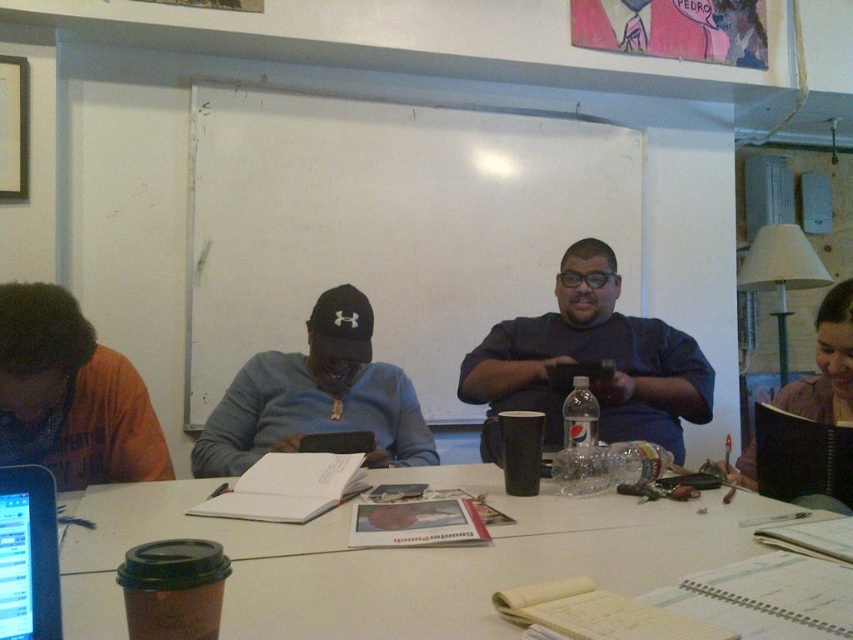
You are a GUI agent. You are given a task and a screenshot of the screen. Output one action in this format:
    pyautogui.click(x=<x>, y=<y>)
    Task: Click on the white matte whiteboard at center
    Image resolution: width=853 pixels, height=640 pixels.
    Given the screenshot: What is the action you would take?
    pyautogui.click(x=387, y=225)

Is point (451, 266) behind point (821, 355)?

Yes, it is.

Identify the location of white matte whiteboard at center. (387, 225).

What do you see at coordinates (399, 557) in the screenshot?
I see `white matte table at center` at bounding box center [399, 557].

Identify the location of white matte table at center. This screenshot has width=853, height=640. (399, 557).

Between orange cotton shirt at left and black matte cap at center, which one appears on the right side from the viewer's perspective?

black matte cap at center

Between orange cotton shirt at left and black matte cap at center, which one appears on the left side from the viewer's perspective?

From the viewer's perspective, orange cotton shirt at left appears more on the left side.

Is point (88, 420) closer to camera compared to point (367, 419)?

Yes, it is in front of point (367, 419).

The image size is (853, 640). What are the coordinates of `orange cotton shirt at left` in the screenshot? It's located at (71, 396).